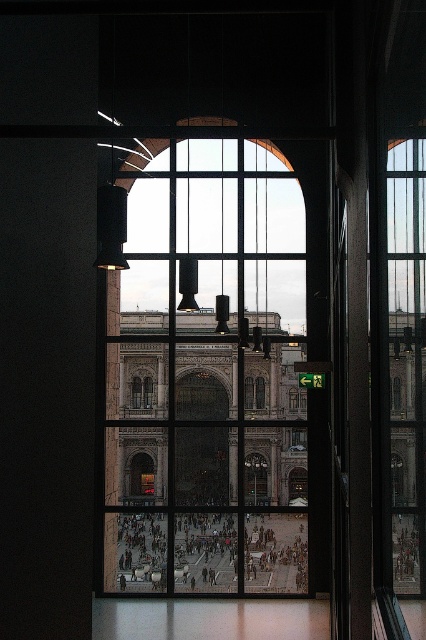
Between point (166, 198) and point (414, 147), which one is positioned in front?

Point (414, 147)

Between clear glass window at center and clear glass window at right, which one is positioned lower?

clear glass window at right is lower down.

In order to click on clear glass window at center in this screenshot , I will do `click(210, 374)`.